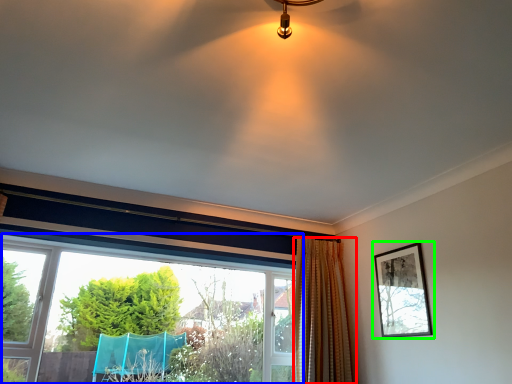
Question: Which object is positioned closest to curtain (highlighted by a red box)? Select from window (highlighted by a blue box) and picture frame (highlighted by a green box).

Choices:
 (A) window
 (B) picture frame

Answer: (B)